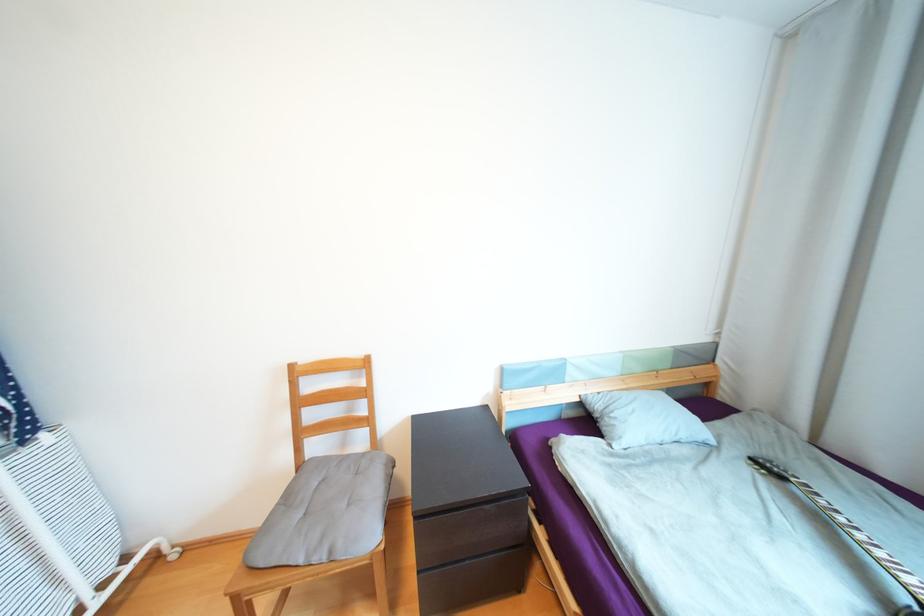
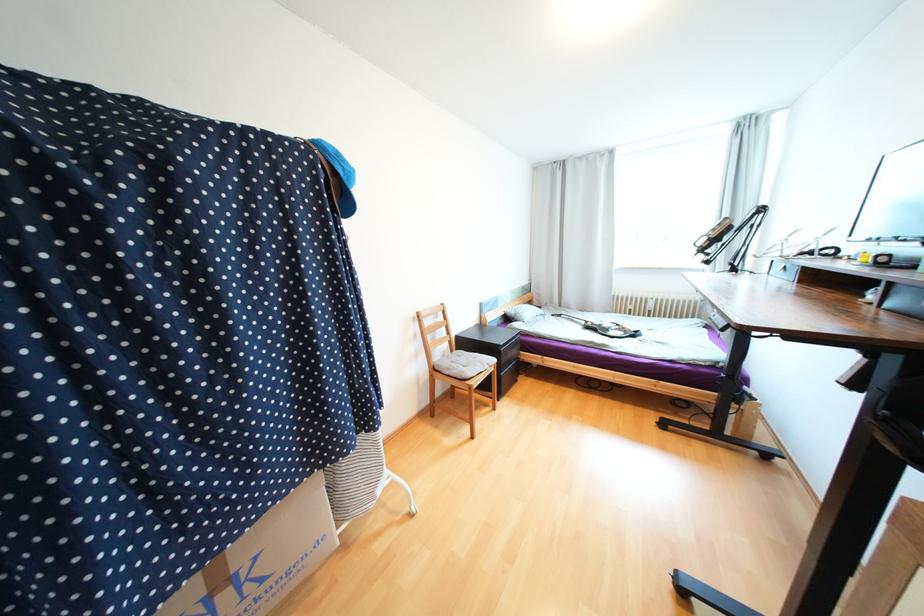
Locate, in the second image, the point that corresponds to the point at 787,477 in the first image.

(565, 315)